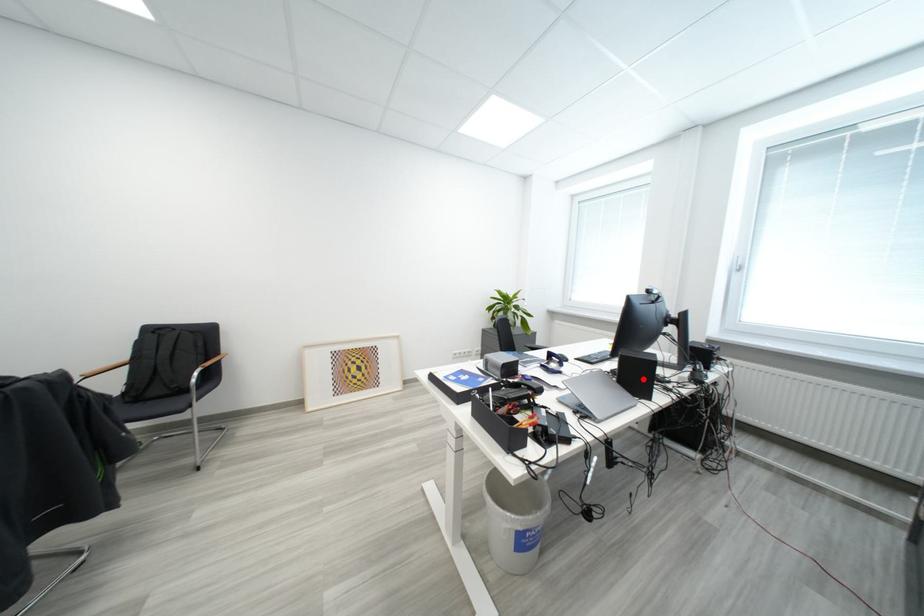
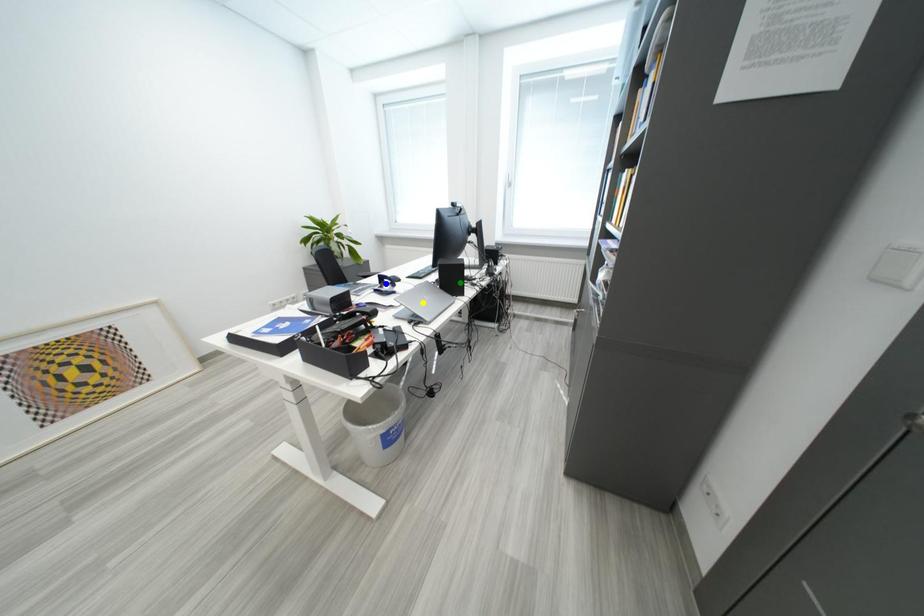
Question: I am providing you with two images of the same scene from different viewpoints. A red point is marked on the first image. You are given multiple points on the second image. Which spot in image 2 lines up with the point in image 1?

Choices:
 (A) green point
 (B) yellow point
 (C) blue point

Answer: (A)